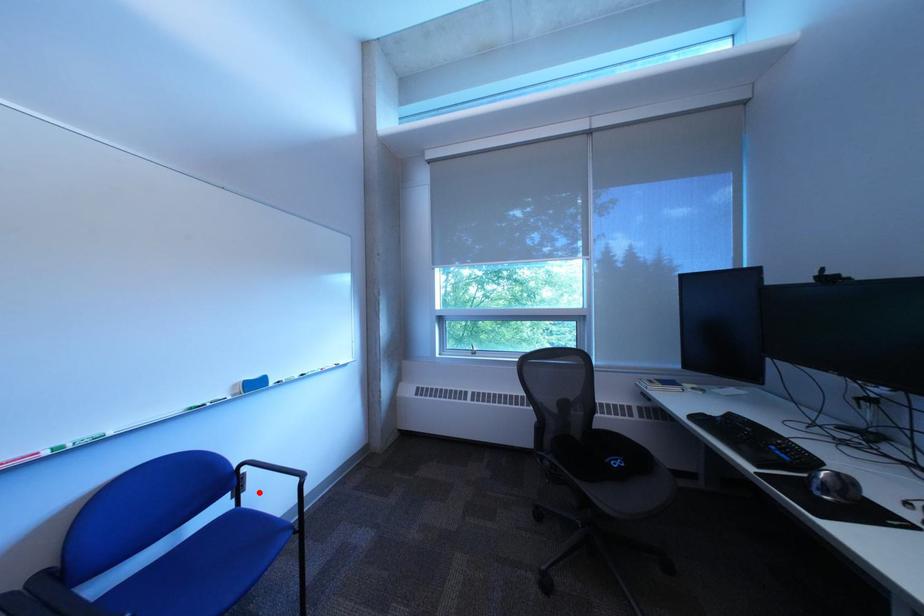
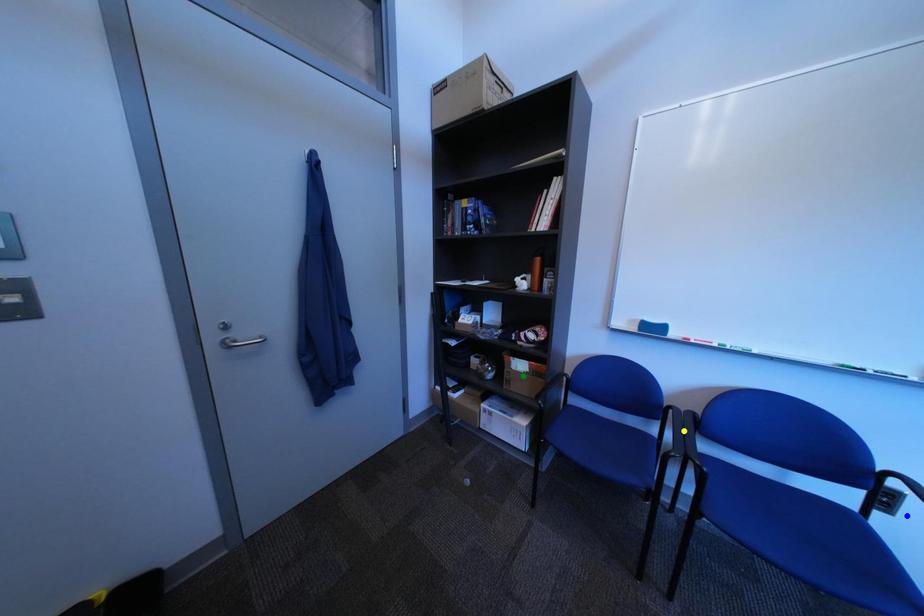
Question: I am providing you with two images of the same scene from different viewpoints. A red point is marked on the first image. You are given multiple points on the second image. Which spot in image 2 lines up with the point in image 1?

Choices:
 (A) yellow point
 (B) green point
 (C) blue point

Answer: (C)